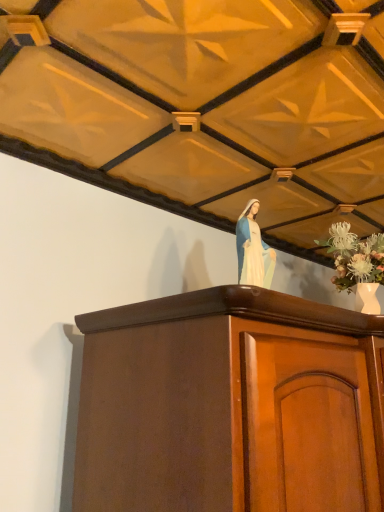
At what (x,y) coordinates should I click in order to perform the action: click on white porcelain statue at upper center. Please return your answer as a coordinate pair (x, y). The height and width of the screenshot is (512, 384). Looking at the image, I should click on (253, 250).

Describe the element at coordinates (354, 257) in the screenshot. I see `white porcelain vase at upper right` at that location.

You are a GUI agent. You are given a task and a screenshot of the screen. Output one action in this format:
    pyautogui.click(x=<x>, y=<y>)
    Task: Click on the mahogany cabinet at center
    
    Given the screenshot: What is the action you would take?
    pyautogui.click(x=227, y=405)

Based on the photo, is white porcelain vase at upper right not near mahogany cabinet at center?

No.

From the image's perspective, is white porcelain vase at upper right below mahogany cabinet at center?

No.

Is white porcelain vase at upper right wider or thinner than mahogany cabinet at center?

Clearly, white porcelain vase at upper right has less width compared to mahogany cabinet at center.

Find the location of a particular element. Image resolution: width=384 pixels, height=512 pixels. furniture below the white porcelain vase at upper right (from a real-world perspective) is located at coordinates (227, 405).

Can you confirm if mahogany cabinet at center is smaller than white porcelain statue at upper center?

Actually, mahogany cabinet at center might be larger than white porcelain statue at upper center.

From a real-world perspective, is mahogany cabinet at center positioned above or below white porcelain statue at upper center?

mahogany cabinet at center is situated lower than white porcelain statue at upper center in the real world.

Which is in front, point (234, 327) or point (252, 253)?

The point (234, 327) is closer to the camera.

Does mahogany cabinet at center lie in front of white porcelain statue at upper center?

Yes, mahogany cabinet at center is closer to the viewer.

The height and width of the screenshot is (512, 384). Identify the location of woman located in front of the white porcelain vase at upper right. (253, 250).

Would you say white porcelain statue at upper center is to the left or to the right of white porcelain vase at upper right in the picture?

Based on their positions, white porcelain statue at upper center is located to the left of white porcelain vase at upper right.

From a real-world perspective, does white porcelain statue at upper center sit lower than white porcelain vase at upper right?

Yes, from a real-world perspective, white porcelain statue at upper center is below white porcelain vase at upper right.

Considering the sizes of objects white porcelain statue at upper center and white porcelain vase at upper right in the image provided, who is taller, white porcelain statue at upper center or white porcelain vase at upper right?

white porcelain vase at upper right is taller.

Is point (247, 220) closer to viewer compared to point (92, 343)?

No.

Would you say white porcelain statue at upper center is a long distance from mahogany cabinet at center?

white porcelain statue at upper center is near mahogany cabinet at center, not far away.

Considering the relative positions of white porcelain statue at upper center and mahogany cabinet at center in the image provided, is white porcelain statue at upper center to the right of mahogany cabinet at center from the viewer's perspective?

No.

Is white porcelain statue at upper center positioned behind mahogany cabinet at center?

Yes, it is.

This screenshot has height=512, width=384. In the image, there is a white porcelain vase at upper right. Find the location of `woman below it (from a real-world perspective)`. woman below it (from a real-world perspective) is located at coordinates (253, 250).

In terms of width, does white porcelain vase at upper right look wider or thinner when compared to white porcelain statue at upper center?

white porcelain vase at upper right is wider than white porcelain statue at upper center.

Does white porcelain vase at upper right turn towards white porcelain statue at upper center?

No.

Who is bigger, white porcelain vase at upper right or white porcelain statue at upper center?

white porcelain vase at upper right.

Which object is further away from the camera, mahogany cabinet at center or white porcelain vase at upper right?

white porcelain vase at upper right is more distant.

Does mahogany cabinet at center turn towards white porcelain vase at upper right?

No, mahogany cabinet at center is not facing towards white porcelain vase at upper right.

Which of these two, mahogany cabinet at center or white porcelain vase at upper right, stands shorter?

Standing shorter between the two is white porcelain vase at upper right.

Identify the location of furniture to the left of white porcelain vase at upper right. This screenshot has height=512, width=384. (227, 405).

Find the location of a particular element. This screenshot has height=512, width=384. woman above the mahogany cabinet at center (from the image's perspective) is located at coordinates (253, 250).

In the scene shown: From the image, which object appears to be nearer to white porcelain vase at upper right, white porcelain statue at upper center or mahogany cabinet at center?

Based on the image, white porcelain statue at upper center appears to be nearer to white porcelain vase at upper right.

Which object lies nearer to the anchor point white porcelain statue at upper center, mahogany cabinet at center or white porcelain vase at upper right?

mahogany cabinet at center.

When comparing their distances from mahogany cabinet at center, does white porcelain statue at upper center or white porcelain vase at upper right seem closer?

The object closer to mahogany cabinet at center is white porcelain statue at upper center.

From the image, which object appears to be nearer to mahogany cabinet at center, white porcelain vase at upper right or white porcelain statue at upper center?

Based on the image, white porcelain statue at upper center appears to be nearer to mahogany cabinet at center.

When comparing their distances from white porcelain vase at upper right, does mahogany cabinet at center or white porcelain statue at upper center seem further?

Among the two, mahogany cabinet at center is located further to white porcelain vase at upper right.

From the image, which object appears to be farther from white porcelain statue at upper center, white porcelain vase at upper right or mahogany cabinet at center?

white porcelain vase at upper right.

You are a GUI agent. You are given a task and a screenshot of the screen. Output one action in this format:
    pyautogui.click(x=<x>, y=<y>)
    Task: Click on the woman between mahogany cabinet at center and white porcelain vase at upper right in the front-back direction
    This screenshot has height=512, width=384.
    Given the screenshot: What is the action you would take?
    coord(253,250)